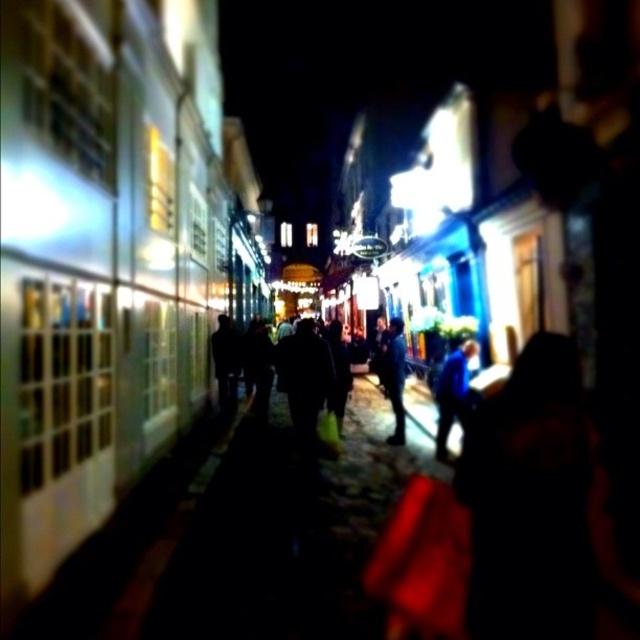
Question: Is the position of blue fabric jacket at center more distant than that of dark blue jacket at center?

Choices:
 (A) yes
 (B) no

Answer: (B)

Question: Is blue fabric jacket at center above dark blue jacket at center?

Choices:
 (A) no
 (B) yes

Answer: (A)

Question: Does blue fabric jacket at center appear over dark blue jacket at center?

Choices:
 (A) yes
 (B) no

Answer: (B)

Question: Which object appears farthest from the camera in this image?

Choices:
 (A) dark blue jacket at center
 (B) blue fabric jacket at center

Answer: (A)

Question: Which of the following is the farthest from the observer?

Choices:
 (A) (460, 412)
 (B) (401, 387)

Answer: (B)